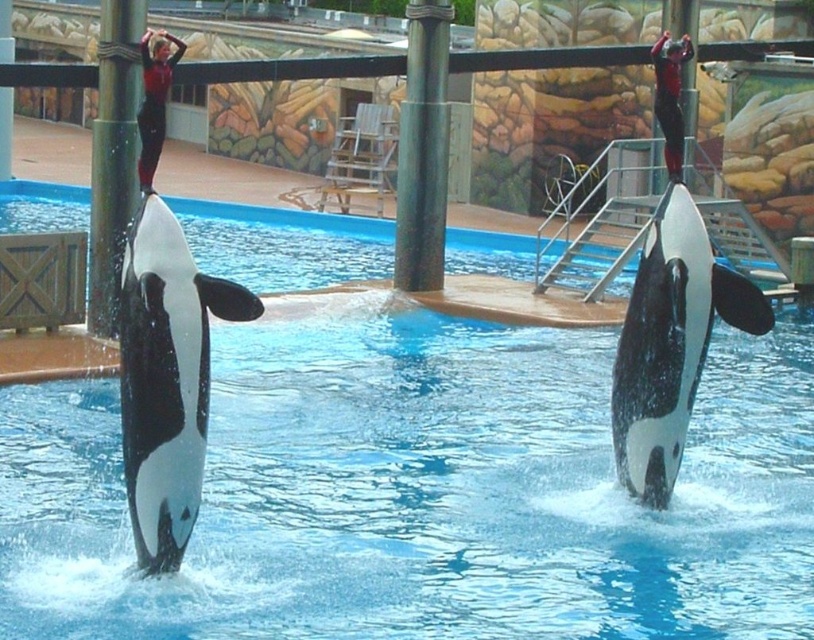
Does blue smooth water at center come behind black/white smooth orca at right?

No.

The height and width of the screenshot is (640, 814). Describe the element at coordinates (422, 492) in the screenshot. I see `blue smooth water at center` at that location.

Who is more distant from viewer, (434,504) or (626,387)?

The point (434,504) is behind.

Locate an element on the screen. Image resolution: width=814 pixels, height=640 pixels. blue smooth water at center is located at coordinates (422, 492).

Is black/white smooth whale at center above green polished wood pole at center?

Incorrect, black/white smooth whale at center is not positioned above green polished wood pole at center.

Locate an element on the screen. black/white smooth whale at center is located at coordinates (165, 378).

Who is positioned more to the left, blue smooth water at center or green polished wood pole at center?

blue smooth water at center is more to the left.

Does blue smooth water at center appear under green polished wood pole at center?

Correct, blue smooth water at center is located below green polished wood pole at center.

Is point (462, 252) behind point (435, 262)?

Yes, point (462, 252) is behind point (435, 262).

Find the location of `blue smooth water at center`. blue smooth water at center is located at coordinates (422, 492).